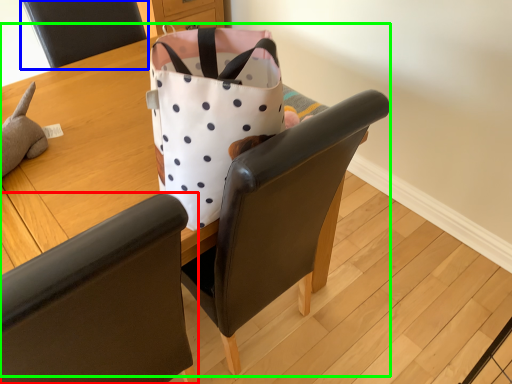
Question: Which object is the closest to the chair (highlighted by a red box)? Choose among these: chair (highlighted by a blue box) or table (highlighted by a green box).

Choices:
 (A) chair
 (B) table

Answer: (B)